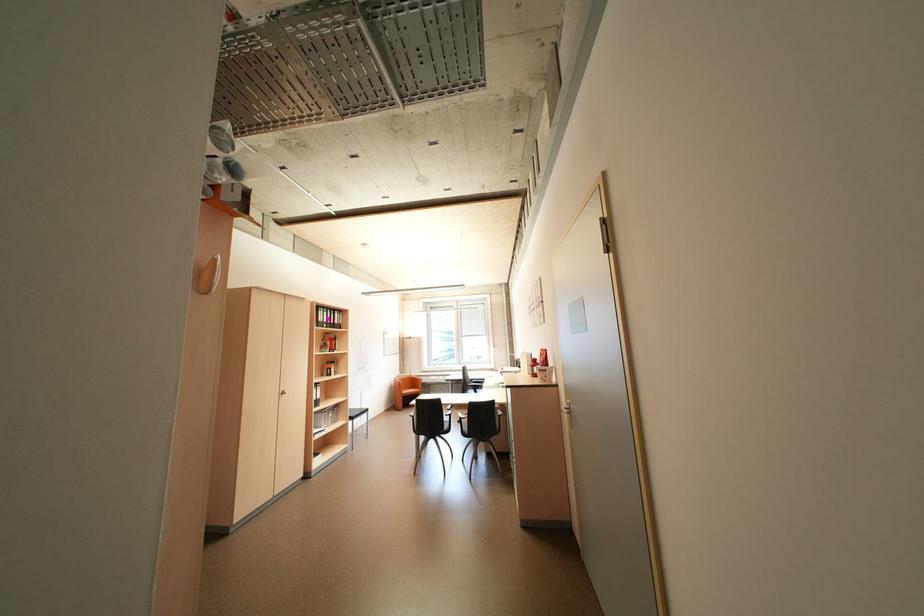
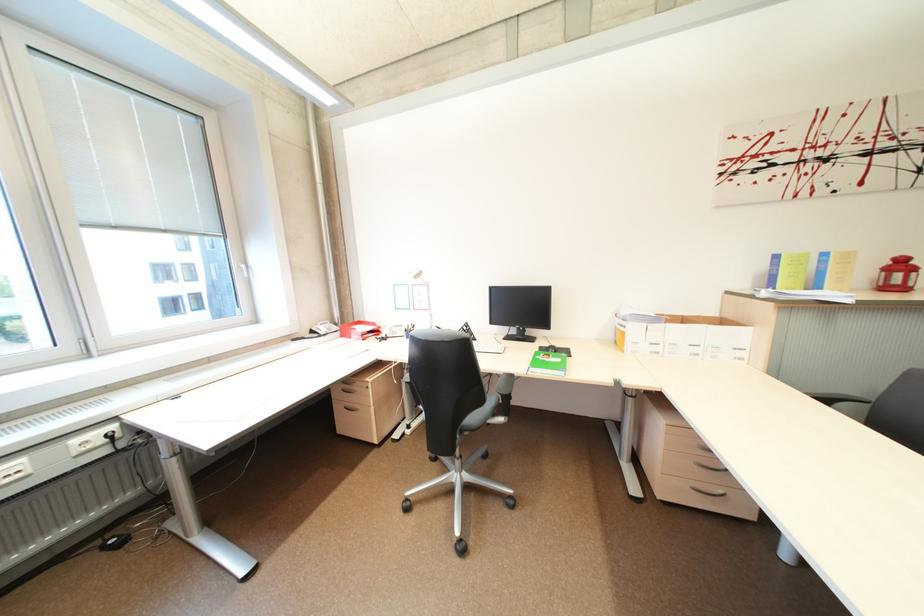
In the second image, find the point that corresponds to pixel 477 392 in the first image.

(482, 419)